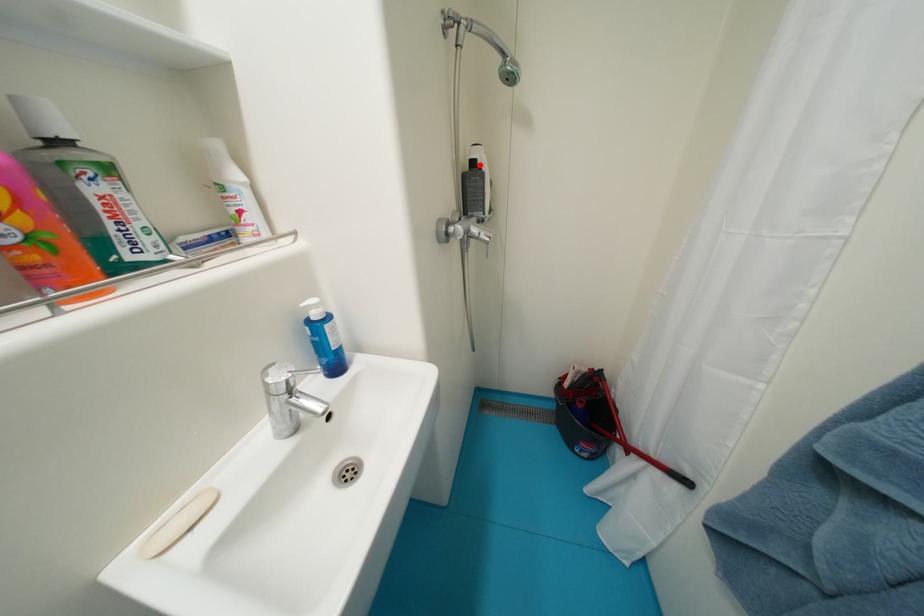
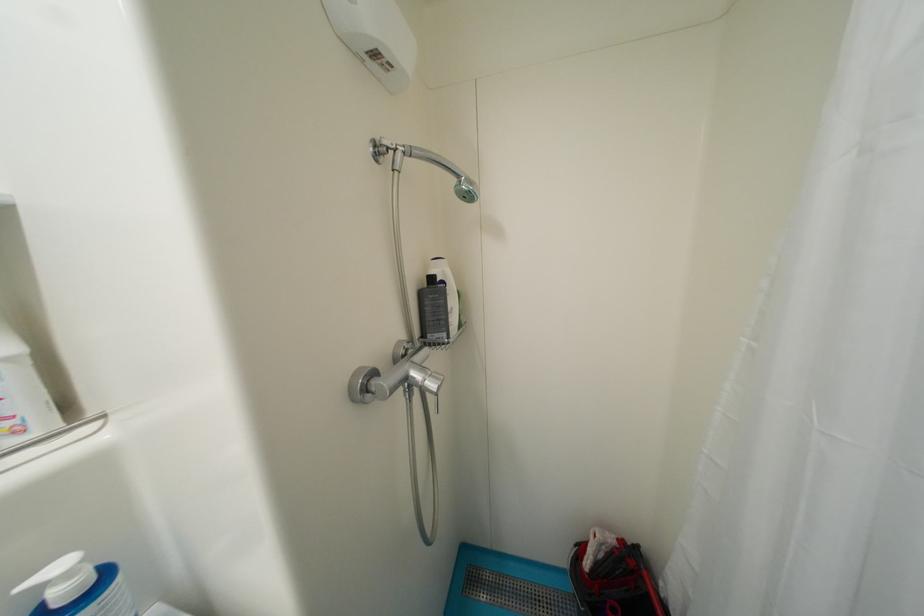
Locate, in the second image, the point that corresponds to the highlighted location in the first image.

(439, 281)